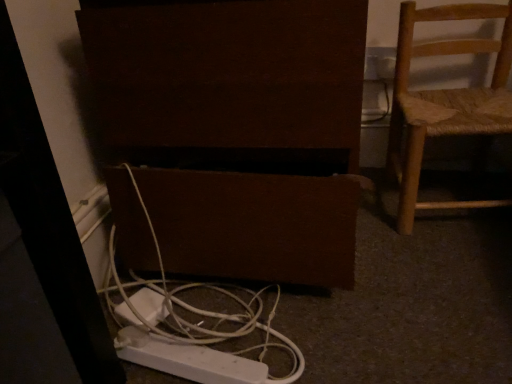
Question: Is white plastic cable at lower center positioned beyond the bounds of woven wood chair at right?

Choices:
 (A) yes
 (B) no

Answer: (A)

Question: Considering the relative sizes of white plastic cable at lower center and woven wood chair at right in the image provided, is white plastic cable at lower center taller than woven wood chair at right?

Choices:
 (A) yes
 (B) no

Answer: (B)

Question: Would you say woven wood chair at right is part of white plastic cable at lower center's contents?

Choices:
 (A) yes
 (B) no

Answer: (B)

Question: Can you confirm if white plastic cable at lower center is thinner than woven wood chair at right?

Choices:
 (A) no
 (B) yes

Answer: (A)

Question: Can you confirm if white plastic cable at lower center is wider than woven wood chair at right?

Choices:
 (A) yes
 (B) no

Answer: (A)

Question: Looking at the image, does white plastic cable at lower center seem bigger or smaller compared to woven wood chair at right?

Choices:
 (A) big
 (B) small

Answer: (B)

Question: Which is correct: white plastic cable at lower center is inside woven wood chair at right, or outside of it?

Choices:
 (A) outside
 (B) inside

Answer: (A)

Question: Relative to woven wood chair at right, is white plastic cable at lower center in front or behind?

Choices:
 (A) front
 (B) behind

Answer: (A)

Question: Visually, is white plastic cable at lower center positioned to the left or to the right of woven wood chair at right?

Choices:
 (A) left
 (B) right

Answer: (A)

Question: In terms of height, does brown matte speaker at lower center look taller or shorter compared to woven wood chair at right?

Choices:
 (A) short
 (B) tall

Answer: (B)

Question: Is brown matte speaker at lower center inside or outside of woven wood chair at right?

Choices:
 (A) inside
 (B) outside

Answer: (B)

Question: Considering the positions of brown matte speaker at lower center and woven wood chair at right in the image, is brown matte speaker at lower center wider or thinner than woven wood chair at right?

Choices:
 (A) wide
 (B) thin

Answer: (A)

Question: From a real-world perspective, relative to woven wood chair at right, is brown matte speaker at lower center vertically above or below?

Choices:
 (A) above
 (B) below

Answer: (A)

Question: Is white plastic outlet at upper right inside or outside of brown matte speaker at lower center?

Choices:
 (A) inside
 (B) outside

Answer: (B)

Question: Would you say white plastic outlet at upper right is to the left or to the right of brown matte speaker at lower center in the picture?

Choices:
 (A) left
 (B) right

Answer: (B)